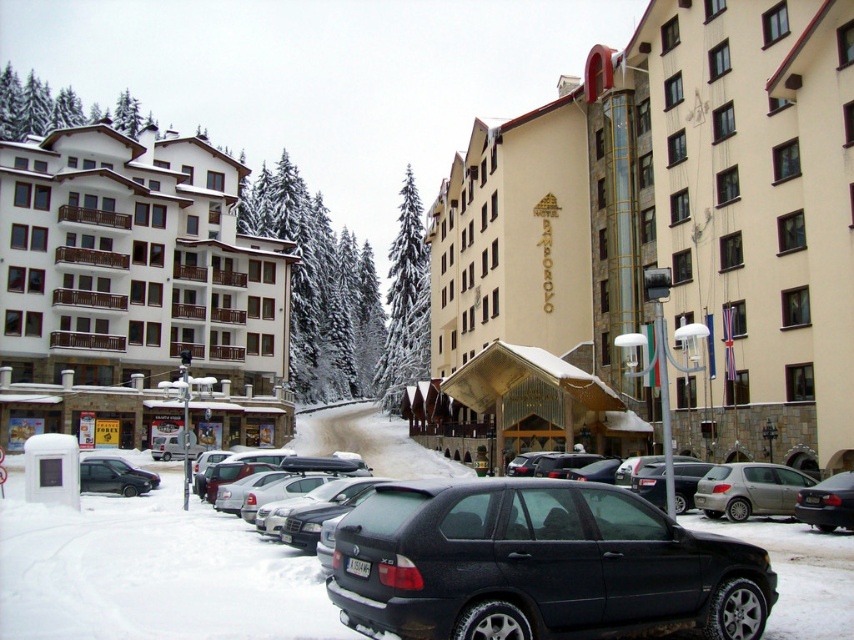
Question: Can you confirm if matte black suv at center is positioned to the right of shiny black sedan at lower right?

Choices:
 (A) yes
 (B) no

Answer: (B)

Question: Does white stone building at left appear over silver metallic hatchback at center-right?

Choices:
 (A) no
 (B) yes

Answer: (B)

Question: Based on their relative distances, which object is nearer to the silver metallic hatchback at center-right?

Choices:
 (A) shiny black sedan at lower right
 (B) matte black suv at center
 (C) beige stone building at center

Answer: (A)

Question: Which of the following is the farthest from the observer?

Choices:
 (A) (168, 243)
 (B) (847, 460)
 (C) (331, 573)

Answer: (A)

Question: Which point is farther to the camera?

Choices:
 (A) matte black suv at center
 (B) matte black car at lower left

Answer: (B)

Question: Does shiny black sedan at lower right have a greater width compared to matte black car at lower left?

Choices:
 (A) no
 (B) yes

Answer: (A)